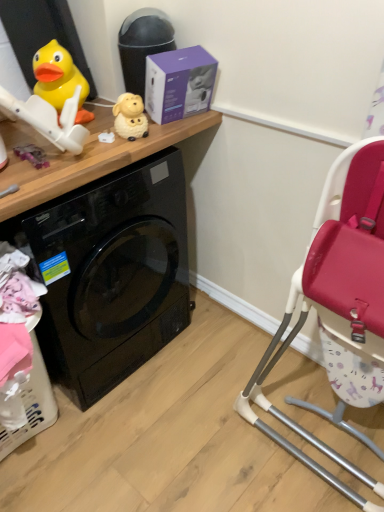
The image size is (384, 512). In order to click on free space in front of white glossy sheep at upper center, the first toy positioned from the right in this screenshot , I will do `click(109, 153)`.